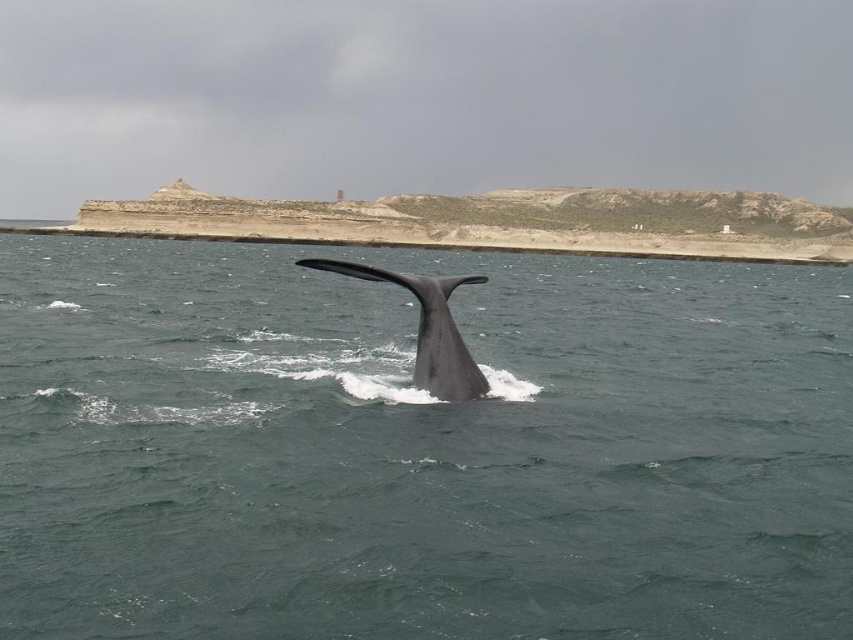
Question: Where is dark blue water at center located in relation to rugged stone coast at center in the image?

Choices:
 (A) below
 (B) above

Answer: (A)

Question: Among these objects, which one is farthest from the camera?

Choices:
 (A) dark blue water at center
 (B) rugged stone coast at center

Answer: (B)

Question: Observing the image, what is the correct spatial positioning of dark blue water at center in reference to rugged stone coast at center?

Choices:
 (A) below
 (B) above

Answer: (A)

Question: Considering the real-world distances, which object is closest to the dark blue water at center?

Choices:
 (A) rugged stone coast at center
 (B) gray matte whale tail at center

Answer: (B)

Question: Which object is positioned farthest from the gray matte whale tail at center?

Choices:
 (A) rugged stone coast at center
 (B) dark blue water at center

Answer: (A)

Question: From the image, what is the correct spatial relationship of dark blue water at center in relation to gray matte whale tail at center?

Choices:
 (A) above
 (B) below

Answer: (A)